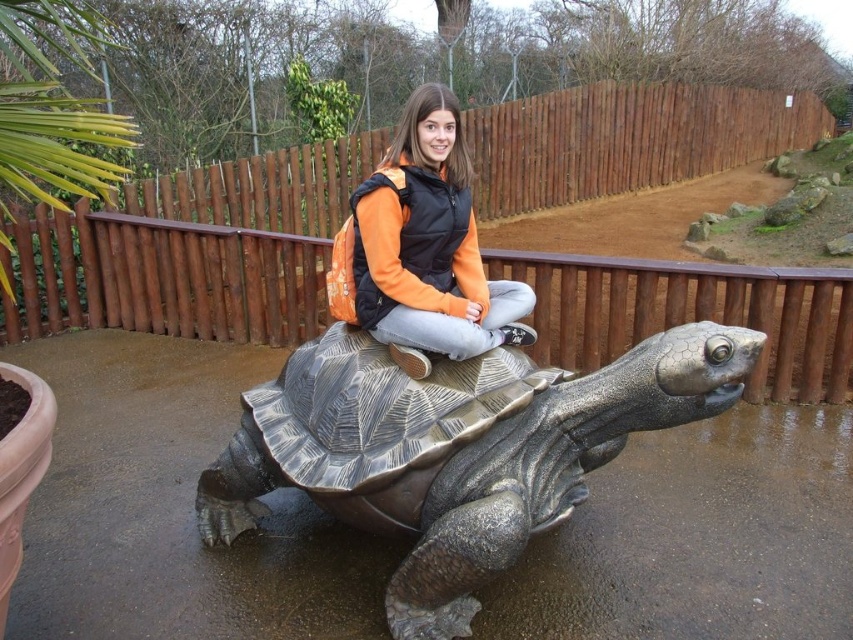
Is metallic tortoise at center positioned in front of orange fabric jacket at center?

Yes, metallic tortoise at center is closer to the viewer.

Does metallic tortoise at center have a larger size compared to orange fabric jacket at center?

Correct, metallic tortoise at center is larger in size than orange fabric jacket at center.

The height and width of the screenshot is (640, 853). What are the coordinates of `metallic tortoise at center` in the screenshot? It's located at (456, 449).

The width and height of the screenshot is (853, 640). I want to click on metallic tortoise at center, so click(x=456, y=449).